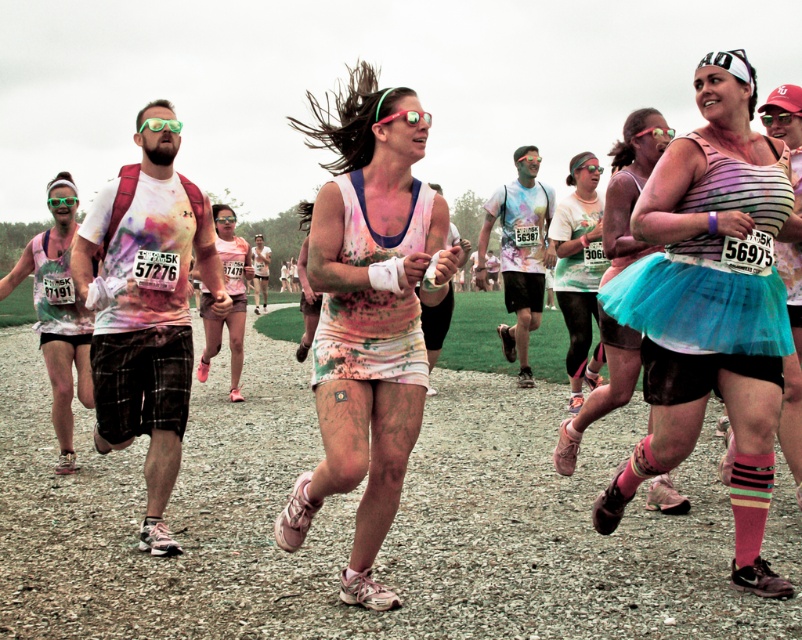
Is matte white tank top at center closer to the viewer compared to matte pink tank top at left?

Yes, matte white tank top at center is closer to the viewer.

Does matte white tank top at center have a greater width compared to matte pink tank top at left?

Yes, matte white tank top at center is wider than matte pink tank top at left.

This screenshot has width=802, height=640. I want to click on matte white tank top at center, so click(367, 314).

Is rainbow striped tank top at center below matte green tank top at center?

Yes, rainbow striped tank top at center is below matte green tank top at center.

Who is positioned more to the right, rainbow striped tank top at center or matte green tank top at center?

matte green tank top at center is more to the right.

Is point (695, 97) in front of point (592, 186)?

Yes, it is in front of point (592, 186).

At what (x,y) coordinates should I click in order to perform the action: click on rainbow striped tank top at center. Please return your answer as a coordinate pair (x, y). This screenshot has width=802, height=640. Looking at the image, I should click on tap(711, 305).

Is the position of rainbow striped tank top at center less distant than that of matte white tank top at center?

No, it is behind matte white tank top at center.

Is rainbow striped tank top at center taller than matte white tank top at center?

In fact, rainbow striped tank top at center may be shorter than matte white tank top at center.

Where is `rainbow striped tank top at center`? The height and width of the screenshot is (640, 802). rainbow striped tank top at center is located at coordinates (711, 305).